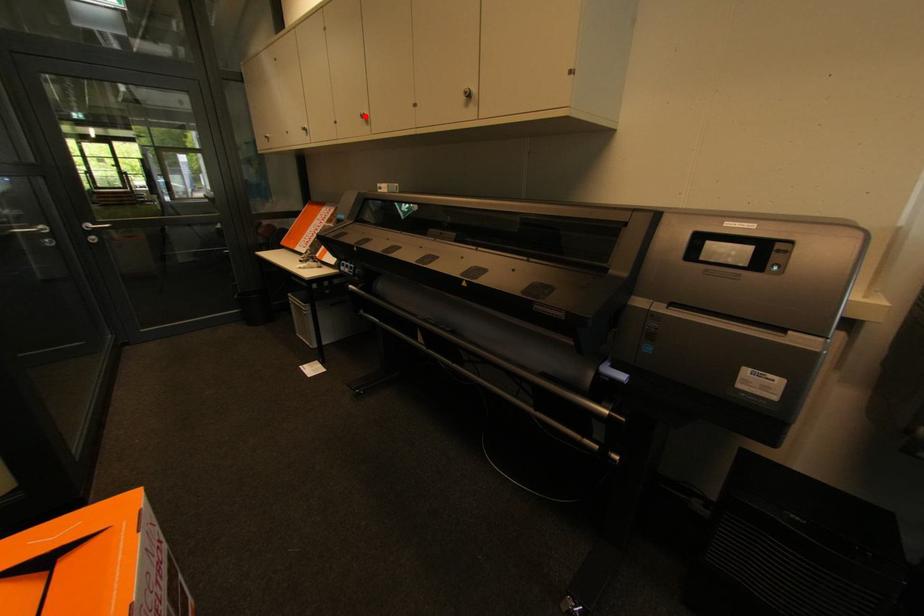
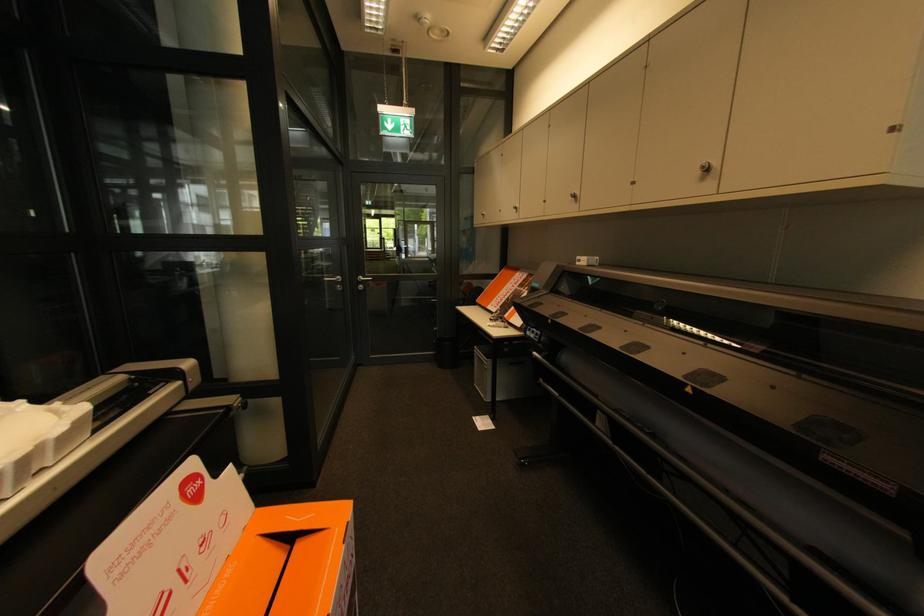
Question: I am providing you with two images of the same scene from different viewpoints. A red point is marked on the first image. At the location where the point appears in image 1, is it still visible in image 2?

Choices:
 (A) Yes
 (B) No

Answer: (A)